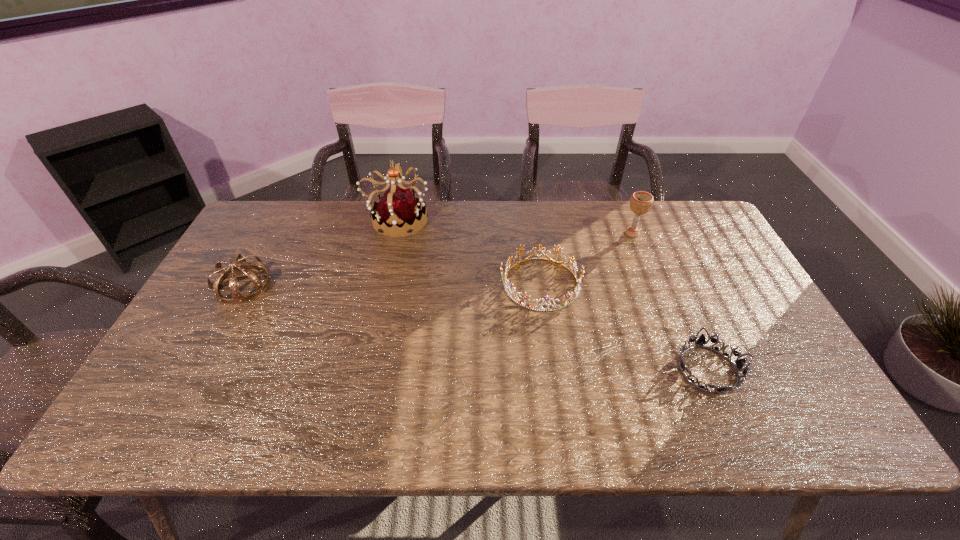
In order to click on object at the left edge in this screenshot , I will do (x=238, y=297).

The image size is (960, 540). I want to click on object that is positioned at the right edge, so click(701, 341).

What are the coordinates of `vacant point at the far edge` in the screenshot? It's located at (482, 243).

In the image, there is a desktop. Where is `vacant area at the near edge`? The image size is (960, 540). vacant area at the near edge is located at coordinates (741, 406).

Identify the location of vacant point at the left edge. The height and width of the screenshot is (540, 960). (242, 253).

The height and width of the screenshot is (540, 960). In order to click on vacant region at the right edge of the desktop in this screenshot , I will do `click(779, 401)`.

The width and height of the screenshot is (960, 540). Identify the location of vacant space at the far right corner. (670, 231).

Identify the location of empty location between the shortest object and the leftmost object. The height and width of the screenshot is (540, 960). (475, 327).

Identify the location of vacant region between the leftmost tiara and the chalice. The width and height of the screenshot is (960, 540). (438, 259).

What are the coordinates of `free spot between the third shortest object and the fourth shortest object` in the screenshot? It's located at (438, 259).